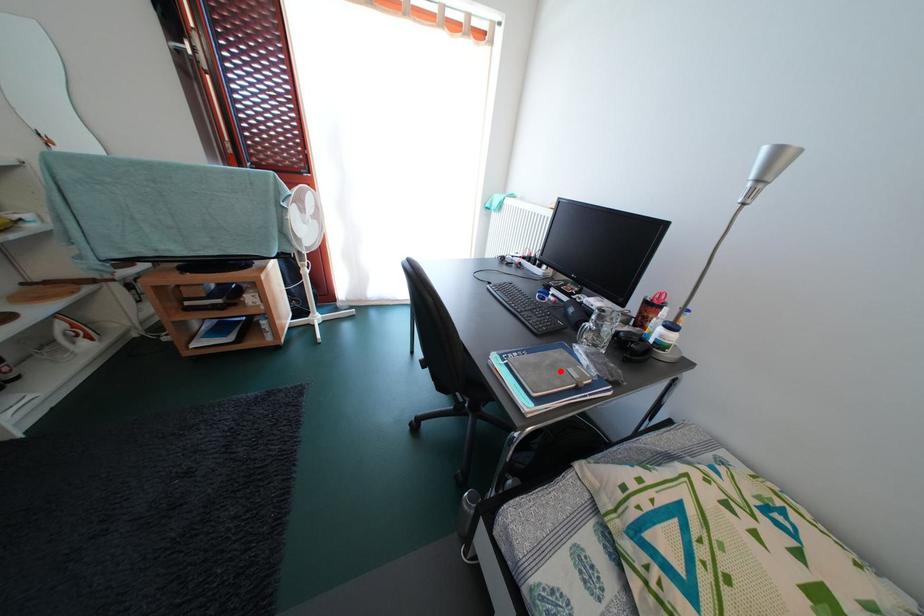
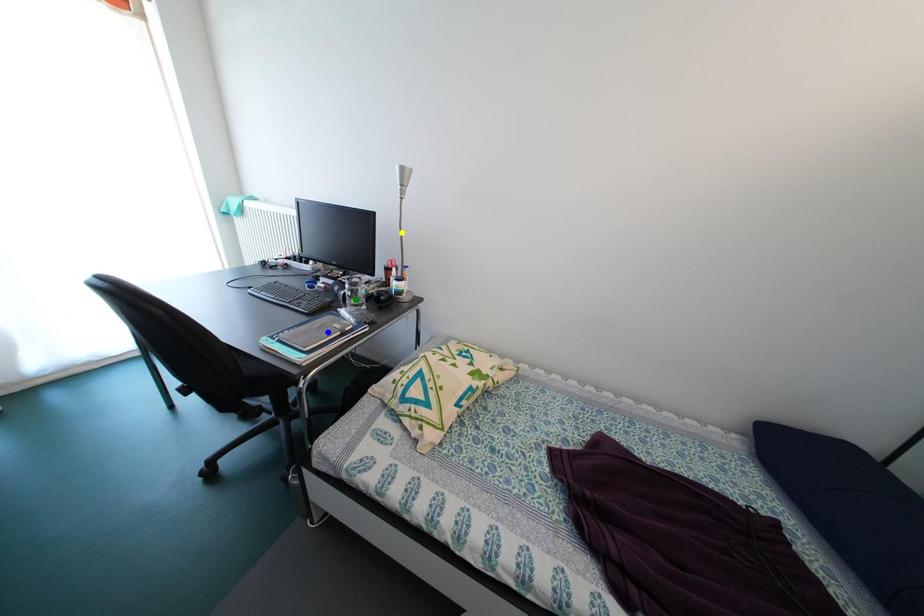
Question: I am providing you with two images of the same scene from different viewpoints. A red point is marked on the first image. You are given multiple points on the second image. Can you choose the point in image 2 that corresponds to the point in image 1?

Choices:
 (A) yellow point
 (B) green point
 (C) blue point

Answer: (C)